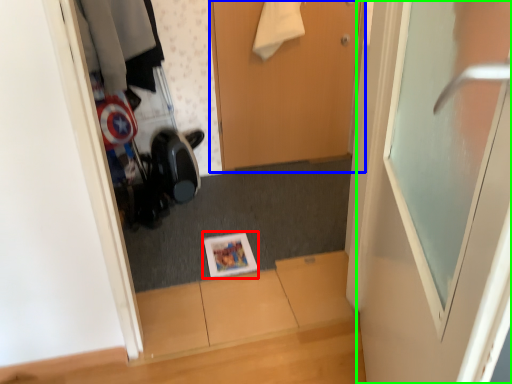
Question: Which is nearer to the magazine (highlighted by a red box)? door (highlighted by a blue box) or door (highlighted by a green box).

Choices:
 (A) door
 (B) door

Answer: (A)